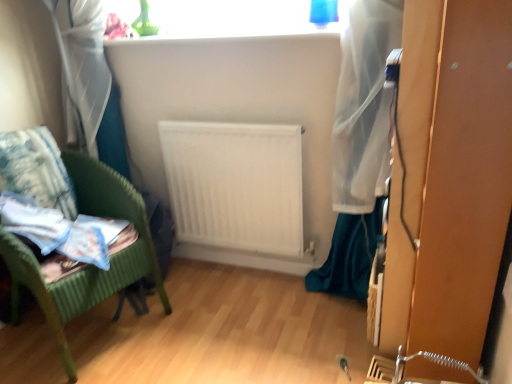
In order to click on vacant space to the right of green wicker chair at left in this screenshot , I will do `click(204, 316)`.